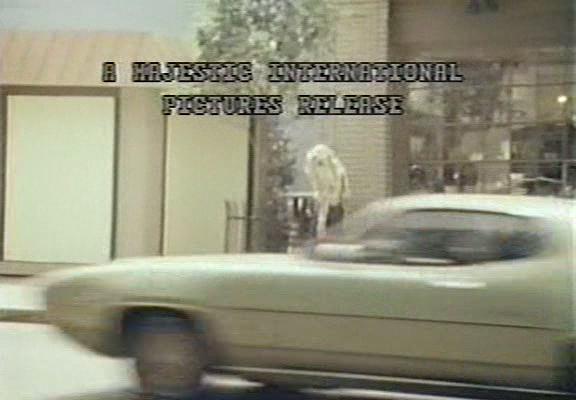
This screenshot has width=576, height=400. In order to click on door in this screenshot , I will do `click(317, 331)`.